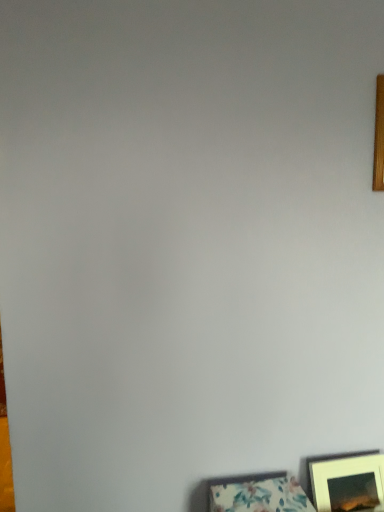
Question: In the image, is matte white picture frame at lower right, the 2th picture frame viewed from the top, on the left side or the right side of floral fabric picture frame at lower right, placed as the 3th picture frame when sorted from top to bottom?

Choices:
 (A) right
 (B) left

Answer: (A)

Question: In terms of height, does matte white picture frame at lower right, marked as the 2th picture frame in a bottom-to-top arrangement, look taller or shorter compared to floral fabric picture frame at lower right, placed as the 3th picture frame when sorted from top to bottom?

Choices:
 (A) tall
 (B) short

Answer: (A)

Question: Which object is the closest to the floral fabric picture frame at lower right, placed as the 3th picture frame when sorted from top to bottom?

Choices:
 (A) matte white picture frame at lower right, marked as the 2th picture frame in a bottom-to-top arrangement
 (B) wooden frame at upper right, the 3th picture frame positioned from the left

Answer: (A)

Question: Estimate the real-world distances between objects in this image. Which object is farther from the wooden frame at upper right, the 3th picture frame positioned from the left?

Choices:
 (A) matte white picture frame at lower right, marked as the 2th picture frame in a bottom-to-top arrangement
 (B) floral fabric picture frame at lower right, the third picture frame when ordered from right to left

Answer: (B)